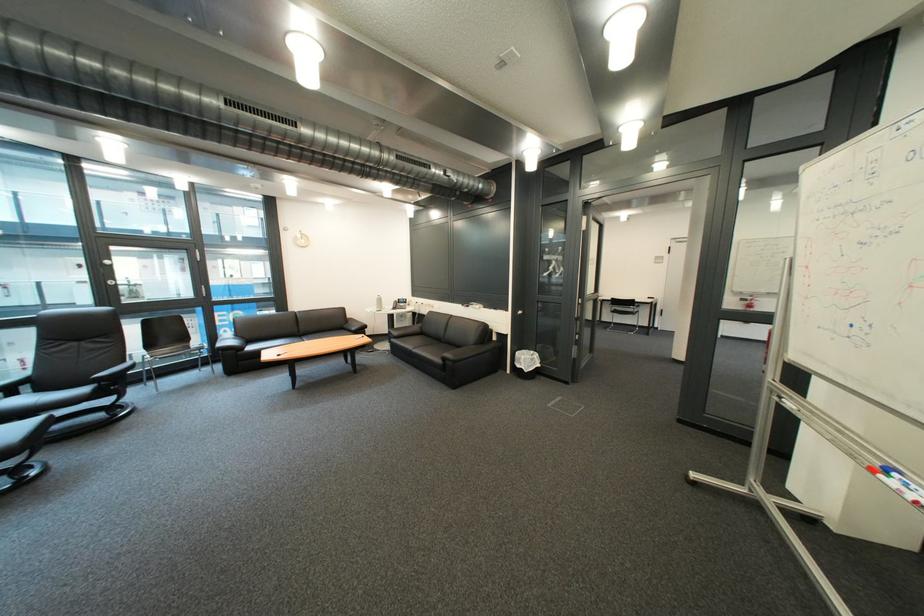
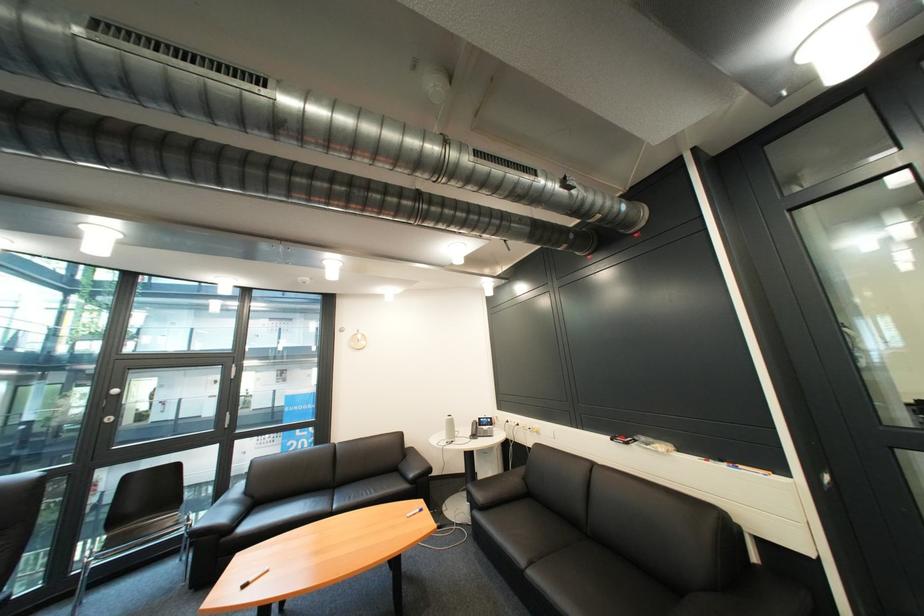
The point at (407, 336) is marked in the first image. Where is the corresponding point in the second image?

(491, 504)